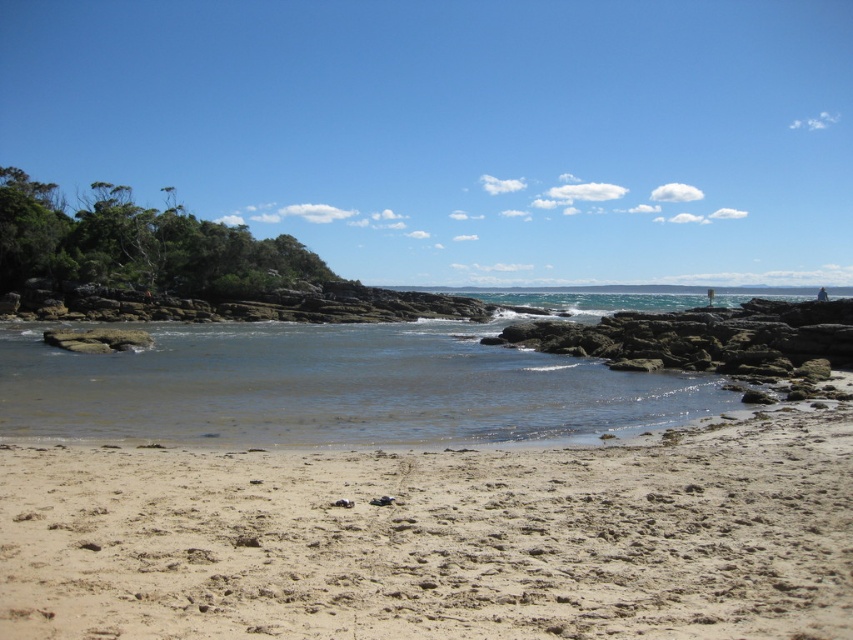
Consider the image. Does light brown sandy beach at lower center have a lesser height compared to clear water at center?

Yes.

Identify the location of light brown sandy beach at lower center. The image size is (853, 640). (439, 538).

At what (x,y) coordinates should I click in order to perform the action: click on light brown sandy beach at lower center. Please return your answer as a coordinate pair (x, y). This screenshot has width=853, height=640. Looking at the image, I should click on (439, 538).